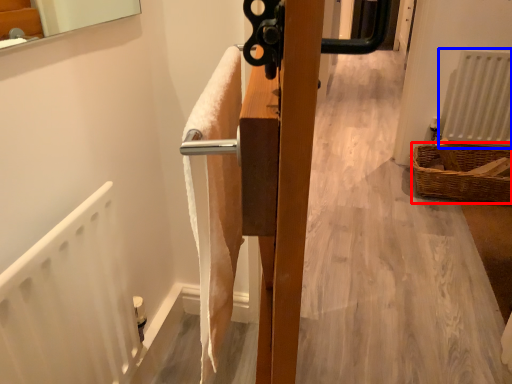
Question: Which of the following is the closest to the observer, basket (highlighted by a red box) or radiator (highlighted by a blue box)?

Choices:
 (A) basket
 (B) radiator

Answer: (A)